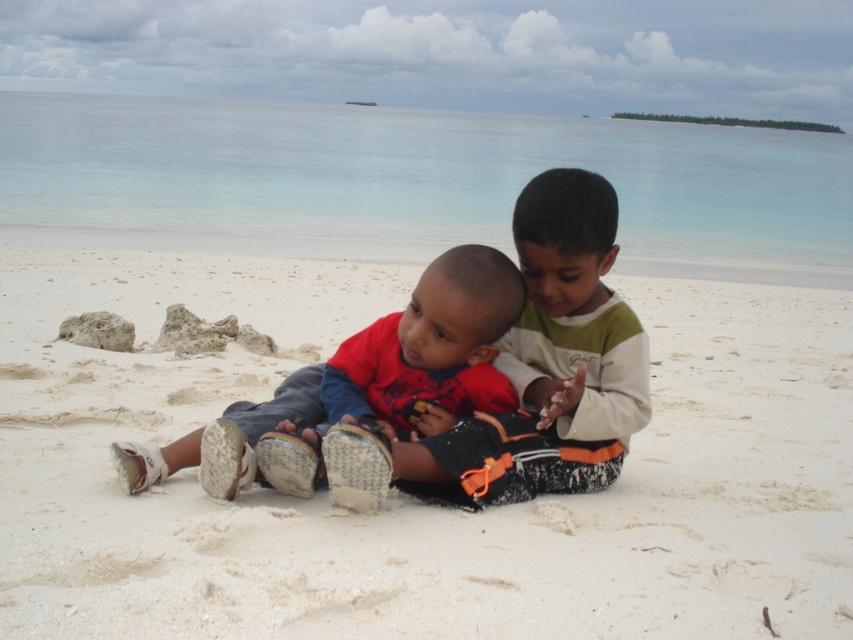
Does white sandy beach at center appear under matte red shirt at center?

Correct, white sandy beach at center is located below matte red shirt at center.

In the scene shown: Can you confirm if white sandy beach at center is shorter than matte red shirt at center?

Indeed, white sandy beach at center has a lesser height compared to matte red shirt at center.

The width and height of the screenshot is (853, 640). I want to click on white sandy beach at center, so click(409, 499).